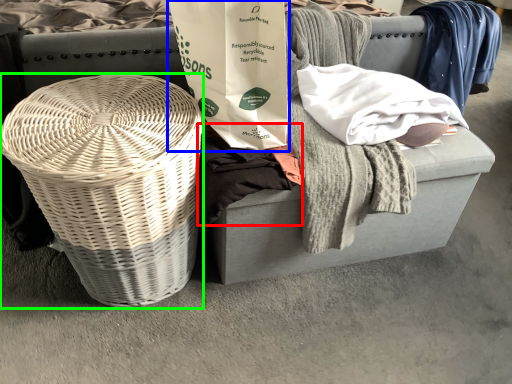
Question: Which object is the farthest from clothing (highlighted by a red box)? Choose among these: shopping bag (highlighted by a blue box) or basket (highlighted by a green box).

Choices:
 (A) shopping bag
 (B) basket

Answer: (B)